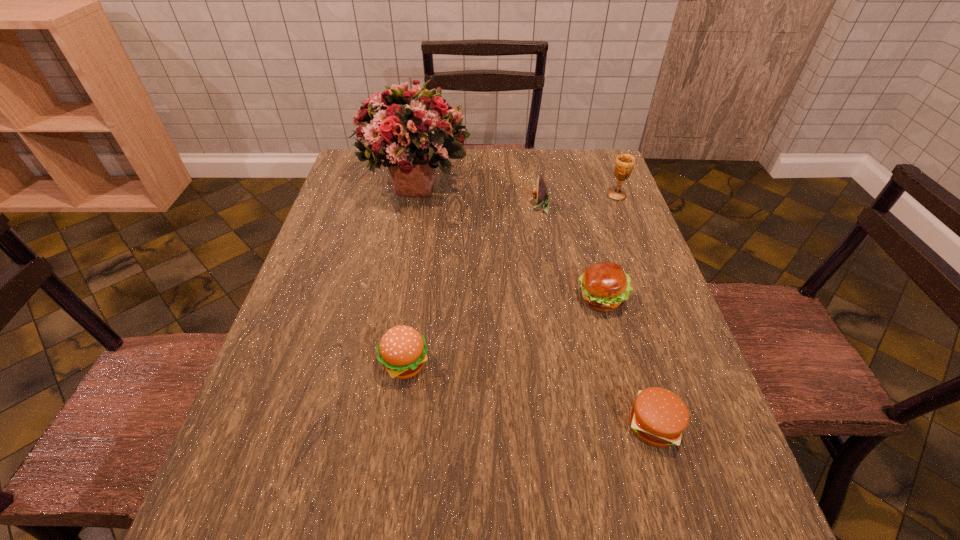
Where is `empty location between the second nearest object and the tallest object`? empty location between the second nearest object and the tallest object is located at coordinates (410, 274).

Locate an element on the screen. Image resolution: width=960 pixels, height=540 pixels. free space between the second nearest hamburger and the chalice is located at coordinates (511, 280).

You are a GUI agent. You are given a task and a screenshot of the screen. Output one action in this format:
    pyautogui.click(x=<x>, y=<y>)
    Task: Click on the vacant region between the avocado and the fourth farthest object
    The height and width of the screenshot is (540, 960).
    Given the screenshot: What is the action you would take?
    pyautogui.click(x=570, y=253)

You are a GUI agent. You are given a task and a screenshot of the screen. Output one action in this format:
    pyautogui.click(x=<x>, y=<y>)
    Task: Click on the blank region between the bouquet and the leftmost hamburger
    The width and height of the screenshot is (960, 540).
    Given the screenshot: What is the action you would take?
    pyautogui.click(x=410, y=274)

Identify the location of vacant space that's between the avocado and the second tallest object. (578, 201).

Locate an element on the screen. The width and height of the screenshot is (960, 540). free space between the rightmost object and the tallest object is located at coordinates (516, 189).

At what (x,y) coordinates should I click in order to perform the action: click on free space between the farthest hamburger and the bouquet. Please return your answer as a coordinate pair (x, y). The image size is (960, 540). Looking at the image, I should click on 509,241.

Identify which object is located as the nearest to the nearest object. Please provide its 2D coordinates. Your answer should be formatted as a tuple, i.e. [(x, y)], where the tuple contains the x and y coordinates of a point satisfying the conditions above.

[(605, 286)]

Where is `object that is the fourth closest to the fourth object from right to left`? This screenshot has width=960, height=540. object that is the fourth closest to the fourth object from right to left is located at coordinates (402, 350).

Locate which hamburger ranks second in proximity to the third object from left to right. Please provide its 2D coordinates. Your answer should be formatted as a tuple, i.e. [(x, y)], where the tuple contains the x and y coordinates of a point satisfying the conditions above.

[(402, 350)]